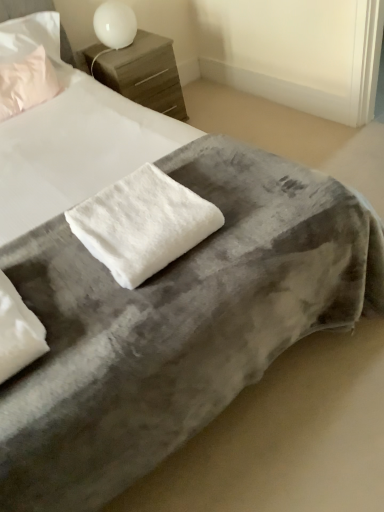
Question: Can you confirm if wooden nightstand at upper center is taller than white glossy table lamp at upper center?

Choices:
 (A) no
 (B) yes

Answer: (B)

Question: Can you confirm if wooden nightstand at upper center is thinner than white glossy table lamp at upper center?

Choices:
 (A) yes
 (B) no

Answer: (B)

Question: Is wooden nightstand at upper center positioned before white glossy table lamp at upper center?

Choices:
 (A) no
 (B) yes

Answer: (A)

Question: From a real-world perspective, is wooden nightstand at upper center positioned under white glossy table lamp at upper center based on gravity?

Choices:
 (A) yes
 (B) no

Answer: (A)

Question: Considering the relative sizes of wooden nightstand at upper center and white glossy table lamp at upper center in the image provided, is wooden nightstand at upper center shorter than white glossy table lamp at upper center?

Choices:
 (A) no
 (B) yes

Answer: (A)

Question: From the image's perspective, is wooden nightstand at upper center located above white glossy table lamp at upper center?

Choices:
 (A) no
 (B) yes

Answer: (A)

Question: From the image's perspective, would you say matte pink pillow at upper left, which is the 1th pillow in top-to-bottom order, is shown under white glossy table lamp at upper center?

Choices:
 (A) no
 (B) yes

Answer: (B)

Question: Is matte pink pillow at upper left, the 2th pillow from the front, at the right side of white glossy table lamp at upper center?

Choices:
 (A) no
 (B) yes

Answer: (A)

Question: Is matte pink pillow at upper left, which is the 1th pillow in top-to-bottom order, positioned with its back to white glossy table lamp at upper center?

Choices:
 (A) no
 (B) yes

Answer: (A)

Question: From a real-world perspective, is matte pink pillow at upper left, which is the 1th pillow in top-to-bottom order, under white glossy table lamp at upper center?

Choices:
 (A) yes
 (B) no

Answer: (B)

Question: From a real-world perspective, is matte pink pillow at upper left, the first pillow positioned from the left, over white glossy table lamp at upper center?

Choices:
 (A) no
 (B) yes

Answer: (B)

Question: Is matte pink pillow at upper left, positioned as the second pillow in right-to-left order, not close to white glossy table lamp at upper center?

Choices:
 (A) yes
 (B) no

Answer: (B)

Question: Is white fluffy towel at center completely or partially inside wooden nightstand at upper center?

Choices:
 (A) no
 (B) yes

Answer: (A)